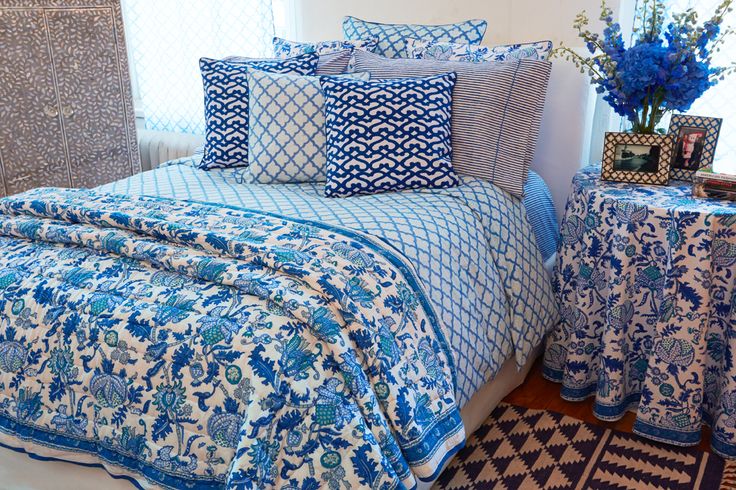
Locate an element on the screen. Image resolution: width=736 pixels, height=490 pixels. curtains is located at coordinates (166, 77).